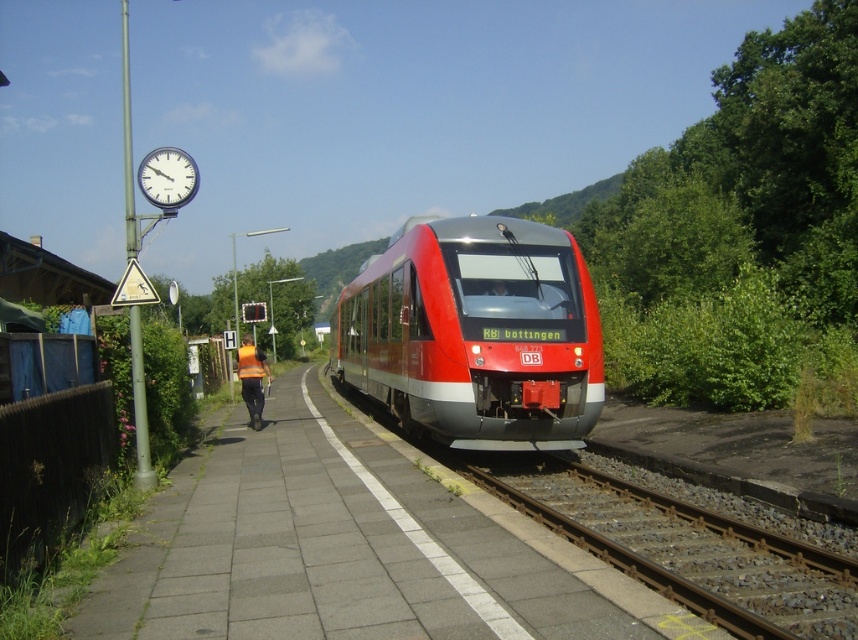
You are a passenger waiting on the platform and want to board the red metallic train at center. You notice a reflective orange vest at center nearby. Since the train is narrower than the vest, will you have enough space to board safely?

The red metallic train at center has a width less than the reflective orange vest at center, which means the train is narrower. However, boarding space depends on platform dimensions, not the vest. Please follow station staff instructions for safe boarding.

You are a passenger waiting at the station and see the red metallic train at center and the brown gravel train track at lower center. Which object is closer to the platform edge marked by the white line?

The brown gravel train track at lower center is closer to the platform edge marked by the white line because the red metallic train at center is to the left of it, placing the track nearer to the edge.